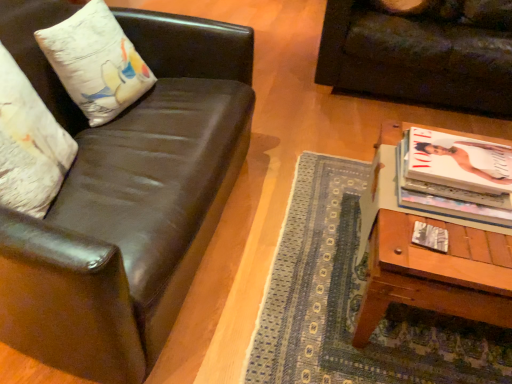
Question: Is shiny black leather couch at left, acting as the 2th studio couch starting from the back, thinner than white cotton pillow at upper left, which is the 2th pillow in front-to-back order?

Choices:
 (A) no
 (B) yes

Answer: (A)

Question: Does shiny black leather couch at left, arranged as the second studio couch when viewed from the right, turn towards white cotton pillow at upper left, which is the 2th pillow in front-to-back order?

Choices:
 (A) yes
 (B) no

Answer: (A)

Question: From a real-world perspective, is shiny black leather couch at left, arranged as the second studio couch when viewed from the right, on top of white cotton pillow at upper left, which is the 2th pillow in front-to-back order?

Choices:
 (A) no
 (B) yes

Answer: (A)

Question: Is shiny black leather couch at left, which is the 1th studio couch from front to back, to the right of white cotton pillow at upper left, which is the 2th pillow in front-to-back order, from the viewer's perspective?

Choices:
 (A) no
 (B) yes

Answer: (B)

Question: From a real-world perspective, is shiny black leather couch at left, which is the 1th studio couch from front to back, physically below white cotton pillow at upper left, which is the 2th pillow in front-to-back order?

Choices:
 (A) no
 (B) yes

Answer: (B)

Question: Does shiny black leather couch at left, acting as the 2th studio couch starting from the back, have a greater width compared to white cotton pillow at upper left, which is the 2th pillow in front-to-back order?

Choices:
 (A) yes
 (B) no

Answer: (A)

Question: From a real-world perspective, does matte white magazine at right sit lower than shiny black leather couch at left, which is the 1th studio couch from front to back?

Choices:
 (A) no
 (B) yes

Answer: (A)

Question: Could you tell me if matte white magazine at right is turned towards shiny black leather couch at left, which ranks as the 1th studio couch in left-to-right order?

Choices:
 (A) no
 (B) yes

Answer: (A)

Question: Is matte white magazine at right outside of shiny black leather couch at left, acting as the 2th studio couch starting from the back?

Choices:
 (A) no
 (B) yes

Answer: (B)

Question: Considering the relative sizes of matte white magazine at right and shiny black leather couch at left, acting as the 2th studio couch starting from the back, in the image provided, is matte white magazine at right wider than shiny black leather couch at left, acting as the 2th studio couch starting from the back,?

Choices:
 (A) no
 (B) yes

Answer: (A)

Question: Is matte white magazine at right shorter than shiny black leather couch at left, acting as the 2th studio couch starting from the back?

Choices:
 (A) yes
 (B) no

Answer: (A)

Question: From the image's perspective, does matte white magazine at right appear higher than shiny black leather couch at left, which is the 1th studio couch from front to back?

Choices:
 (A) yes
 (B) no

Answer: (B)

Question: Is matte white magazine at right with dark brown leather couch at upper right, the 2th studio couch positioned from the front?

Choices:
 (A) no
 (B) yes

Answer: (A)